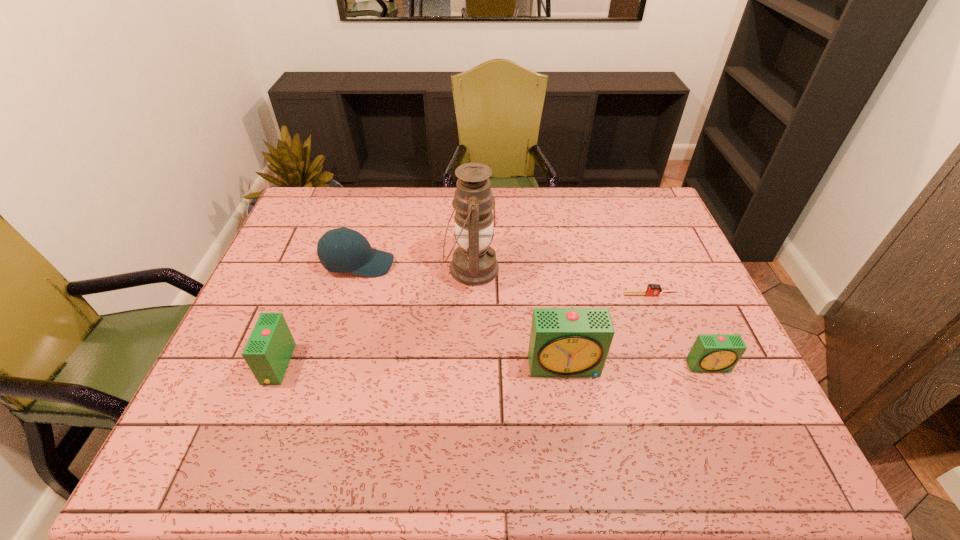
Identify the location of the second shortest alarm clock. Image resolution: width=960 pixels, height=540 pixels. tap(268, 351).

I want to click on the tallest alarm clock, so click(564, 342).

What are the coordinates of `the fifth shortest object` in the screenshot? It's located at (564, 342).

The width and height of the screenshot is (960, 540). In order to click on the rightmost alarm clock in this screenshot , I will do `click(711, 353)`.

Where is `the fifth tallest object`? the fifth tallest object is located at coordinates (711, 353).

This screenshot has height=540, width=960. Find the location of `oil lamp`. oil lamp is located at coordinates (474, 262).

What are the coordinates of `the tallest object` in the screenshot? It's located at (474, 262).

You are a GUI agent. You are given a task and a screenshot of the screen. Output one action in this format:
    pyautogui.click(x=<x>, y=<y>)
    Task: Click on the baseball cap
    The width and height of the screenshot is (960, 540).
    Given the screenshot: What is the action you would take?
    pyautogui.click(x=342, y=250)

Find the location of a particular element. The width and height of the screenshot is (960, 540). the shortest object is located at coordinates (652, 289).

This screenshot has width=960, height=540. Identify the location of vacant space situated on the front-facing side of the second tallest alarm clock. (222, 364).